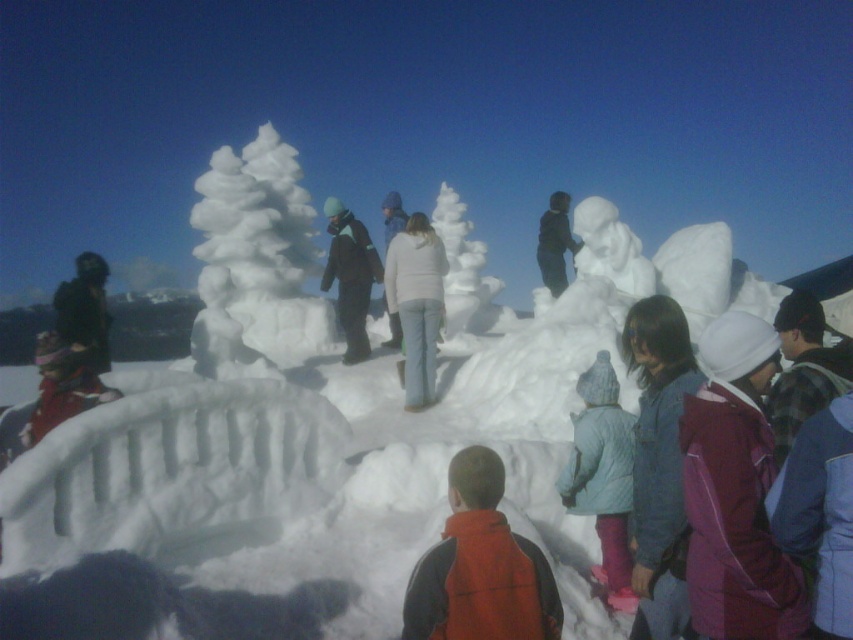
You are standing in the snowy scene and want to move from point A to point B. Point A is at coordinates point (x=262, y=339) and point B is at coordinates point (x=498, y=545). Which direction should you move to go from point A to point B?

To move from point A to point B, you should move towards the upper right direction since point B is located at a higher coordinate in both the x and y axes compared to point A.

You are standing in the snowy scene and want to touch both the white frosty tree at center and the orange fleece vest at center. Which object should you reach for first to touch the one closer to you?

You should reach for the white frosty tree at center first because it is closer to you than the orange fleece vest at center.